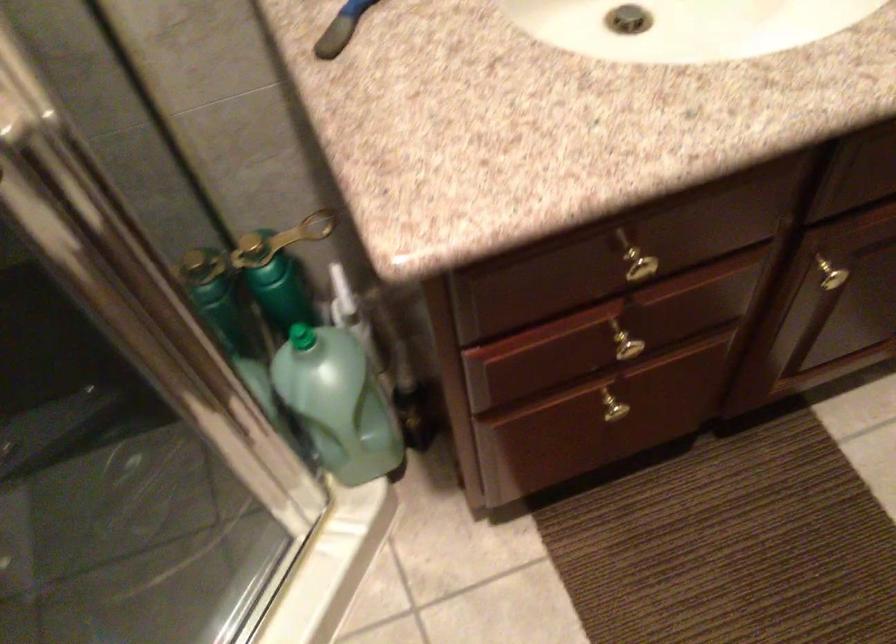
What are the coordinates of `gold metal key` in the screenshot? It's located at (280, 240).